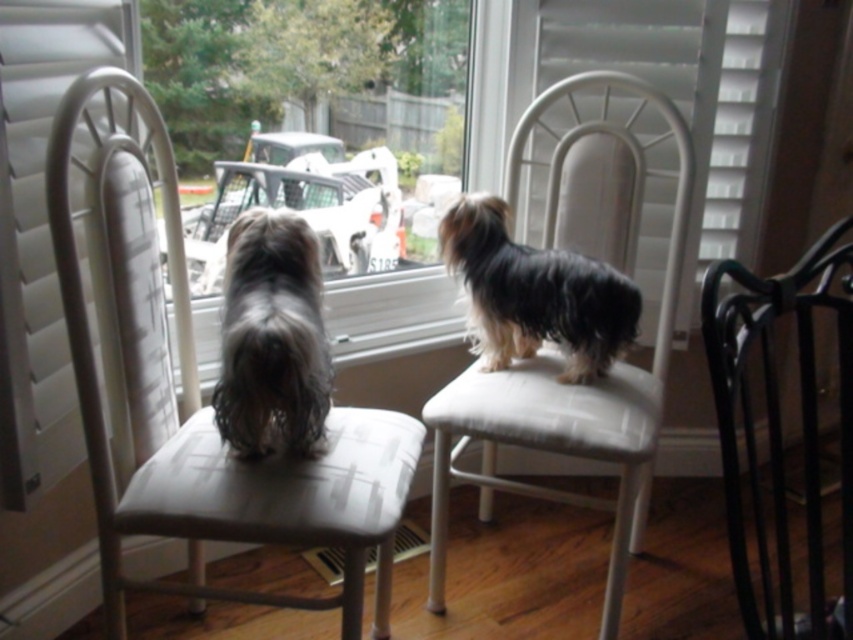
Between black metal chair at lower right and shiny black fur at center, which one appears on the right side from the viewer's perspective?

From the viewer's perspective, black metal chair at lower right appears more on the right side.

The height and width of the screenshot is (640, 853). I want to click on black metal chair at lower right, so click(780, 429).

Locate an element on the screen. black metal chair at lower right is located at coordinates (780, 429).

Does matte gray chair at left appear over shiny black fur at center?

Incorrect, matte gray chair at left is not positioned above shiny black fur at center.

At what (x,y) coordinates should I click in order to perform the action: click on matte gray chair at left. Please return your answer as a coordinate pair (x, y). The image size is (853, 640). Looking at the image, I should click on (207, 413).

Does black metal chair at lower right appear on the left side of white fabric stool at center?

In fact, black metal chair at lower right is to the right of white fabric stool at center.

Measure the distance between black metal chair at lower right and camera.

black metal chair at lower right and camera are 36.07 inches apart.

Locate an element on the screen. The height and width of the screenshot is (640, 853). black metal chair at lower right is located at coordinates (780, 429).